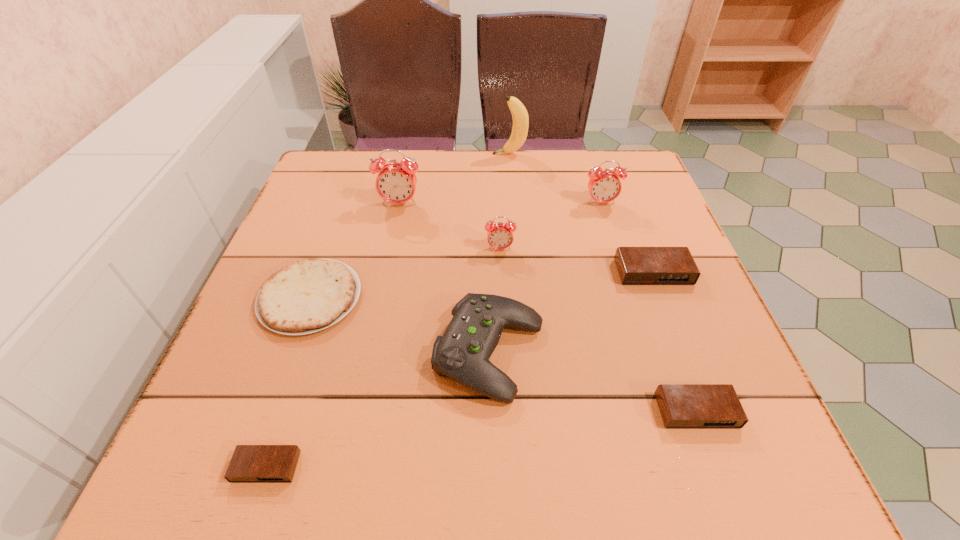
I want to click on vacant point located between the tortilla and the smallest black alarm clock, so pos(288,382).

I want to click on free space between the second smallest red alarm clock and the fifth tallest object, so click(x=545, y=278).

The image size is (960, 540). In order to click on free space between the banana and the sixth tallest object in this screenshot , I will do 582,213.

Where is `vacant area between the sixth nearest object and the beige tortilla`? The width and height of the screenshot is (960, 540). vacant area between the sixth nearest object and the beige tortilla is located at coordinates (405, 273).

I want to click on free space between the tallest alarm clock and the beige tortilla, so click(355, 251).

Locate an element on the screen. This screenshot has width=960, height=540. object that is the fifth nearest to the second nearest black alarm clock is located at coordinates (309, 295).

I want to click on object that is the third closest to the second shortest alarm clock, so click(499, 236).

Select which alarm clock is the closest to the fifth tallest alarm clock. Please provide its 2D coordinates. Your answer should be formatted as a tuple, i.e. [(x, y)], where the tuple contains the x and y coordinates of a point satisfying the conditions above.

[(636, 265)]

Select which alarm clock is the closest to the third nearest alarm clock. Please provide its 2D coordinates. Your answer should be formatted as a tuple, i.e. [(x, y)], where the tuple contains the x and y coordinates of a point satisfying the conditions above.

[(604, 186)]

Identify which red alarm clock is the nearest to the banana. Please provide its 2D coordinates. Your answer should be formatted as a tuple, i.e. [(x, y)], where the tuple contains the x and y coordinates of a point satisfying the conditions above.

[(604, 186)]